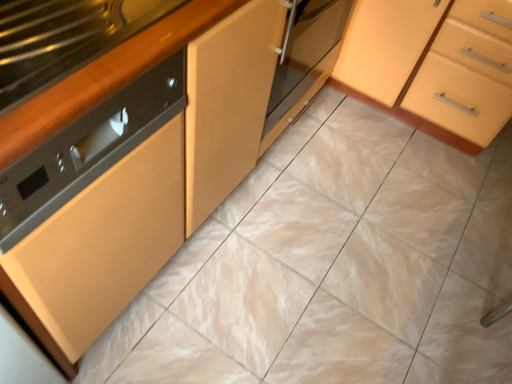
Question: Can you confirm if matte orange cabinet at center-right is smaller than black glossy countertop at left?

Choices:
 (A) yes
 (B) no

Answer: (B)

Question: From the image's perspective, is matte orange cabinet at center-right on black glossy countertop at left?

Choices:
 (A) yes
 (B) no

Answer: (A)

Question: Could you tell me if matte orange cabinet at center-right is facing black glossy countertop at left?

Choices:
 (A) yes
 (B) no

Answer: (A)

Question: Can you confirm if matte orange cabinet at center-right is bigger than black glossy countertop at left?

Choices:
 (A) no
 (B) yes

Answer: (B)

Question: Is matte orange cabinet at center-right looking in the opposite direction of black glossy countertop at left?

Choices:
 (A) no
 (B) yes

Answer: (A)

Question: From a real-world perspective, is matte orange cabinet at center-right under black glossy countertop at left?

Choices:
 (A) yes
 (B) no

Answer: (A)

Question: From a real-world perspective, is black glossy countertop at left physically above matte orange cabinet at center-right?

Choices:
 (A) yes
 (B) no

Answer: (A)

Question: Is black glossy countertop at left completely or partially outside of matte orange cabinet at center-right?

Choices:
 (A) no
 (B) yes

Answer: (B)

Question: Considering the relative positions of black glossy countertop at left and matte orange cabinet at center-right in the image provided, is black glossy countertop at left to the left of matte orange cabinet at center-right from the viewer's perspective?

Choices:
 (A) no
 (B) yes

Answer: (B)

Question: Is black glossy countertop at left beside matte orange cabinet at center-right?

Choices:
 (A) no
 (B) yes

Answer: (A)

Question: Is matte orange cabinet at center-right inside black glossy countertop at left?

Choices:
 (A) yes
 (B) no

Answer: (B)

Question: Would you say black glossy countertop at left is a long distance from matte orange cabinet at center-right?

Choices:
 (A) no
 (B) yes

Answer: (B)

Question: In the image, is black glossy countertop at left positioned in front of or behind matte orange cabinet at center-right?

Choices:
 (A) front
 (B) behind

Answer: (A)